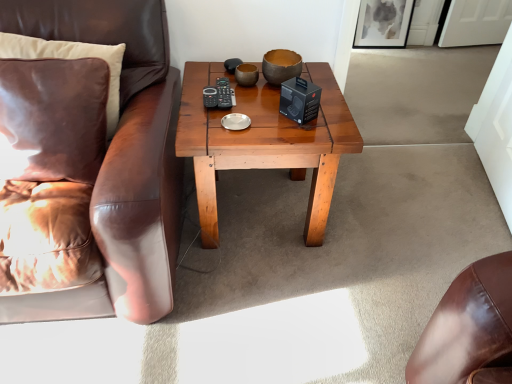
Question: Does velvet brown pillow at left, which ranks as the second pillow in back-to-front order, have a lesser height compared to wooden coffee table at center?

Choices:
 (A) yes
 (B) no

Answer: (A)

Question: Can you confirm if velvet brown pillow at left, arranged as the 1th pillow when viewed from the front, is thinner than wooden coffee table at center?

Choices:
 (A) yes
 (B) no

Answer: (A)

Question: From the image's perspective, is velvet brown pillow at left, arranged as the 1th pillow when viewed from the front, below wooden coffee table at center?

Choices:
 (A) yes
 (B) no

Answer: (B)

Question: Is velvet brown pillow at left, arranged as the 1th pillow when viewed from the front, positioned behind wooden coffee table at center?

Choices:
 (A) yes
 (B) no

Answer: (B)

Question: Is velvet brown pillow at left, arranged as the 1th pillow when viewed from the front, smaller than wooden coffee table at center?

Choices:
 (A) no
 (B) yes

Answer: (B)

Question: Would you say suede pillow at left, marked as the 1th pillow in a back-to-front arrangement, is to the left or to the right of matte gray painting at upper right in the picture?

Choices:
 (A) left
 (B) right

Answer: (A)

Question: Is suede pillow at left, marked as the 1th pillow in a back-to-front arrangement, inside the boundaries of matte gray painting at upper right, or outside?

Choices:
 (A) outside
 (B) inside

Answer: (A)

Question: Is suede pillow at left, which ranks as the 2th pillow in front-to-back order, bigger or smaller than matte gray painting at upper right?

Choices:
 (A) big
 (B) small

Answer: (A)

Question: Relative to matte gray painting at upper right, is suede pillow at left, which ranks as the 2th pillow in front-to-back order, in front or behind?

Choices:
 (A) front
 (B) behind

Answer: (A)

Question: In terms of height, does brown leather chair at left look taller or shorter compared to velvet brown pillow at left, arranged as the 1th pillow when viewed from the front?

Choices:
 (A) short
 (B) tall

Answer: (B)

Question: From the image's perspective, is brown leather chair at left positioned above or below velvet brown pillow at left, which ranks as the second pillow in back-to-front order?

Choices:
 (A) below
 (B) above

Answer: (A)

Question: Does point (131, 67) appear closer or farther from the camera than point (2, 105)?

Choices:
 (A) farther
 (B) closer

Answer: (A)

Question: From a real-world perspective, is brown leather chair at left above or below velvet brown pillow at left, arranged as the 1th pillow when viewed from the front?

Choices:
 (A) below
 (B) above

Answer: (A)

Question: From their relative heights in the image, would you say brown leather chair at left is taller or shorter than matte gray painting at upper right?

Choices:
 (A) tall
 (B) short

Answer: (A)

Question: Would you say brown leather chair at left is inside or outside matte gray painting at upper right?

Choices:
 (A) outside
 (B) inside

Answer: (A)